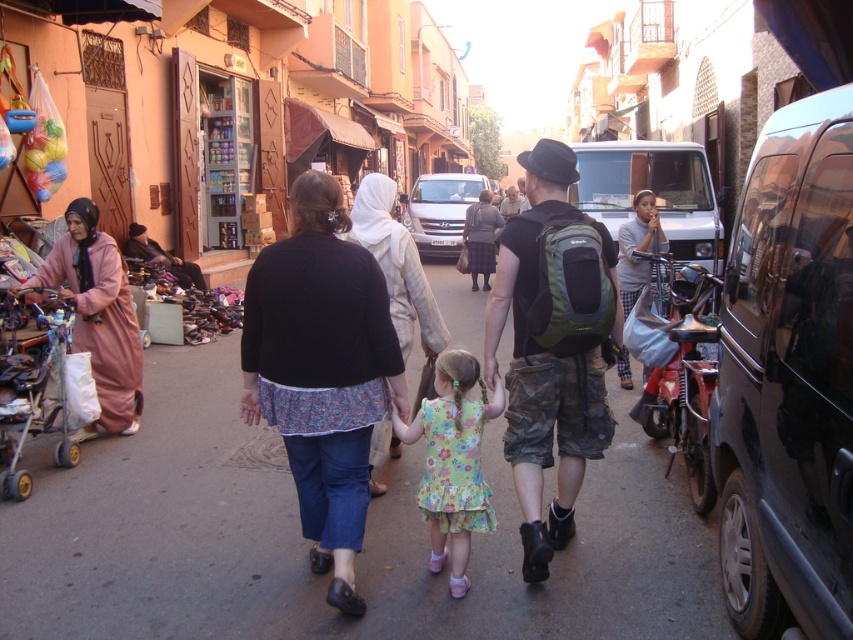
Which of these two, silver metallic van at center or light blue fabric bag at right, stands taller?

Standing taller between the two is silver metallic van at center.

Can you confirm if silver metallic van at center is bigger than light blue fabric bag at right?

Yes.

Image resolution: width=853 pixels, height=640 pixels. Find the location of `silver metallic van at center`. silver metallic van at center is located at coordinates (440, 211).

Can you confirm if black cotton shirt at center is positioned to the right of dark brown leather jacket at center?

No, black cotton shirt at center is not to the right of dark brown leather jacket at center.

Consider the image. Is black cotton shirt at center positioned at the back of dark brown leather jacket at center?

That is False.

At what (x,y) coordinates should I click in order to perform the action: click on black cotton shirt at center. Please return your answer as a coordinate pair (x, y). Looking at the image, I should click on (321, 371).

Is pink fabric dress at left smaller than dark brown leather jacket at center?

Yes.

Who is more distant from viewer, (67, 266) or (485, 269)?

The point (485, 269) is behind.

Who is more forward, (99, 282) or (485, 268)?

Positioned in front is point (99, 282).

Locate an element on the screen. Image resolution: width=853 pixels, height=640 pixels. pink fabric dress at left is located at coordinates (97, 316).